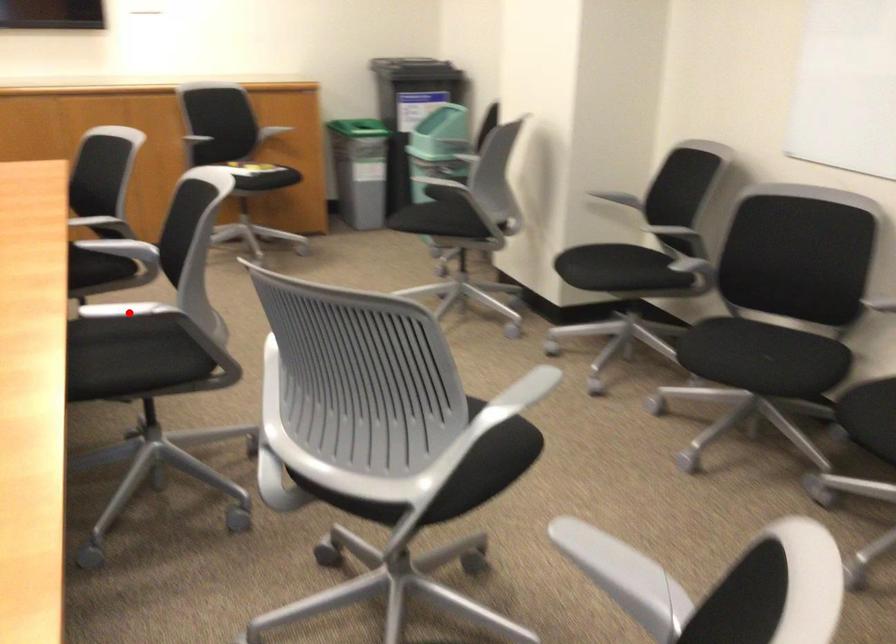
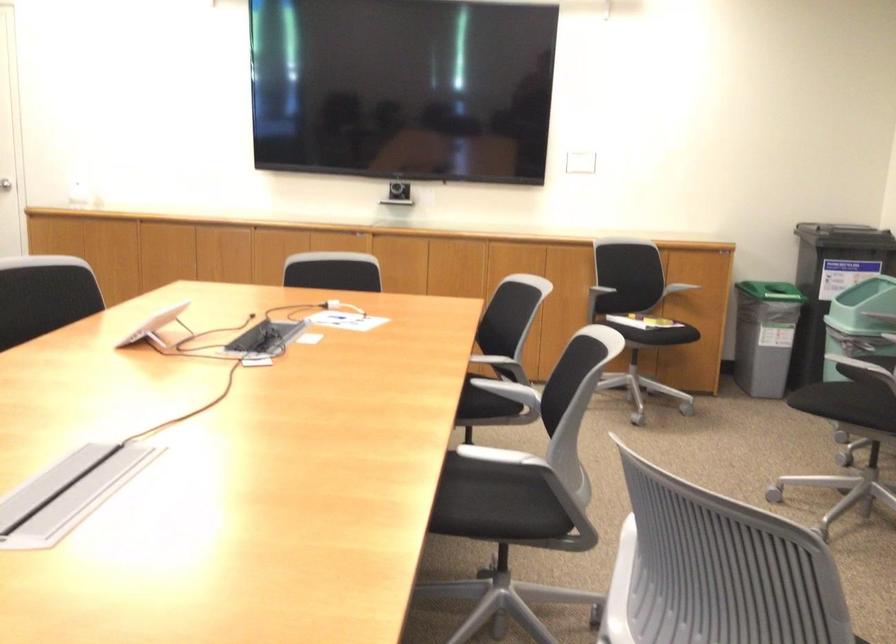
Where in the second image is the point corresponding to the highlighted location from the first image?

(492, 460)